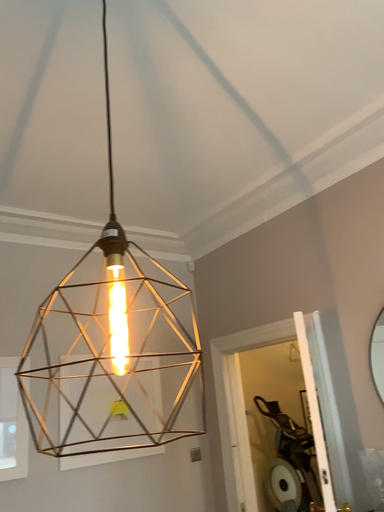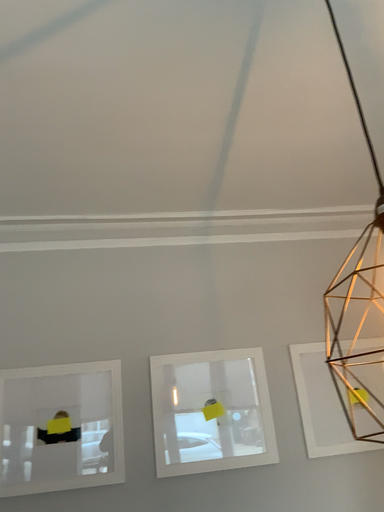
Question: Which way did the camera rotate in the video?

Choices:
 (A) rotated left
 (B) rotated right

Answer: (A)